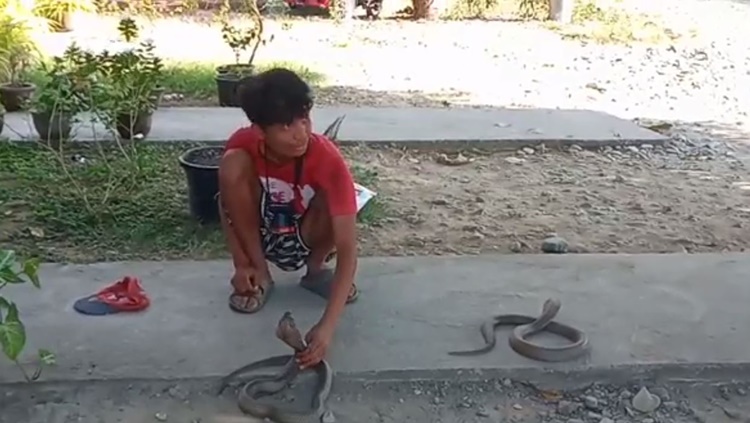
This screenshot has height=423, width=750. I want to click on flower pots, so click(x=202, y=161), click(x=142, y=109), click(x=54, y=115), click(x=225, y=78).